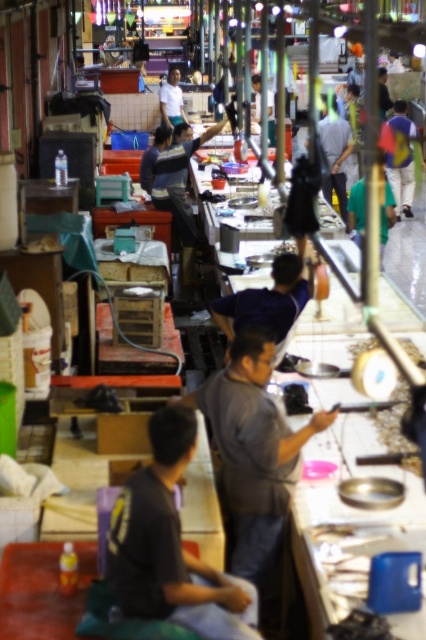
Does point (221, 579) lie behind point (400, 173)?

That is False.

Which is more to the left, dark gray shirt at lower center or blue fabric shirt at upper right?

From the viewer's perspective, dark gray shirt at lower center appears more on the left side.

Between point (233, 589) and point (408, 180), which one is positioned behind?

The point (408, 180) is more distant.

Identify the location of dark gray shirt at lower center. This screenshot has height=640, width=426. (170, 545).

Which is more to the left, dark gray shirt at lower center or gray matte shirt at center?

dark gray shirt at lower center

Who is positioned more to the right, dark gray shirt at lower center or gray matte shirt at center?

From the viewer's perspective, gray matte shirt at center appears more on the right side.

Describe the element at coordinates (170, 545) in the screenshot. I see `dark gray shirt at lower center` at that location.

Find the location of a particular element. dark gray shirt at lower center is located at coordinates (170, 545).

Who is positioned more to the left, dark blue shirt at center or blue fabric shirt at upper right?

From the viewer's perspective, dark blue shirt at center appears more on the left side.

Looking at this image, is the position of dark blue shirt at center less distant than that of blue fabric shirt at upper right?

Yes.

Is point (293, 291) farther from camera compared to point (400, 122)?

No, (293, 291) is in front of (400, 122).

Locate an element on the screen. This screenshot has height=640, width=426. dark blue shirt at center is located at coordinates (267, 301).